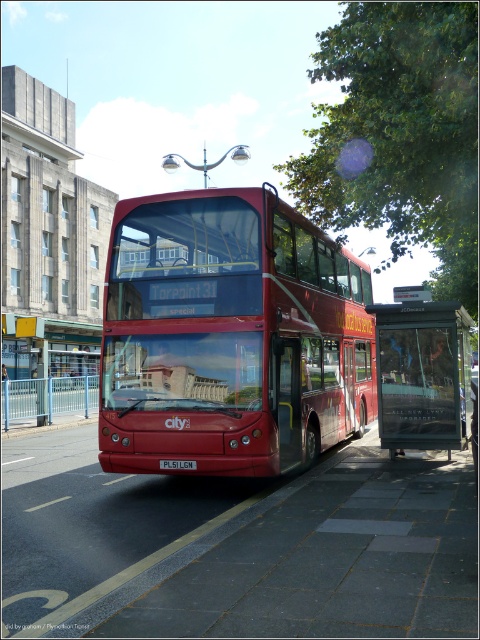
Question: Estimate the real-world distances between objects in this image. Which object is closer to the shiny red bus at center?

Choices:
 (A) red plastic license plate at center
 (B) metallic bus stop at center

Answer: (B)

Question: Is shiny red bus at center thinner than red plastic license plate at center?

Choices:
 (A) no
 (B) yes

Answer: (A)

Question: Does shiny red bus at center appear on the right side of metallic bus stop at center?

Choices:
 (A) no
 (B) yes

Answer: (A)

Question: Which point is closer to the camera?

Choices:
 (A) shiny red bus at center
 (B) metallic bus stop at center

Answer: (A)

Question: Is metallic bus stop at center thinner than red plastic license plate at center?

Choices:
 (A) no
 (B) yes

Answer: (A)

Question: Which point is closer to the camera?

Choices:
 (A) (172, 461)
 (B) (408, 316)
 (C) (322, 296)

Answer: (A)